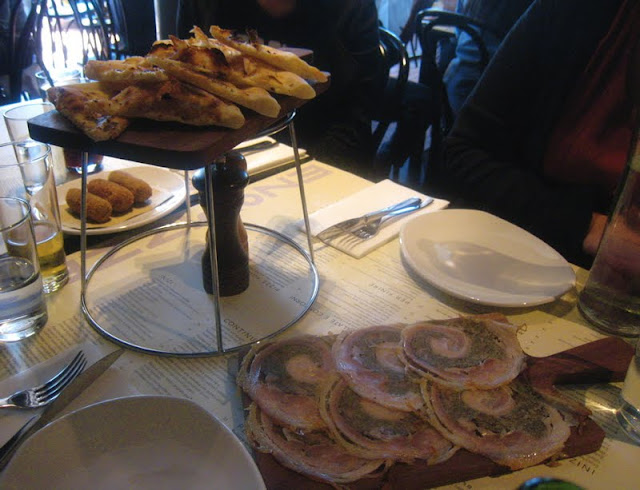
Locate an element on the screen. The height and width of the screenshot is (490, 640). trivet is located at coordinates (220, 349).